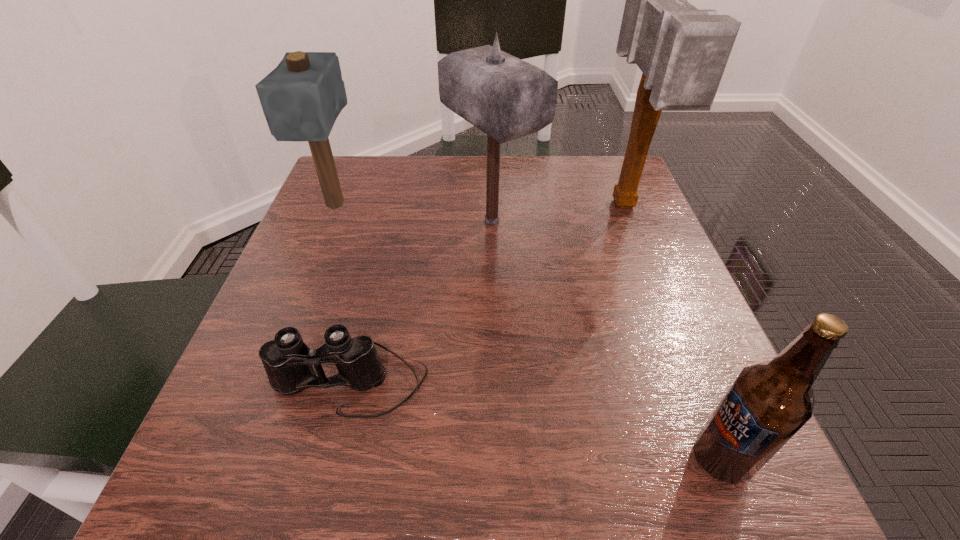
The height and width of the screenshot is (540, 960). Identify the location of the rightmost mallet. [682, 51].

Find the location of a particular element. This screenshot has width=960, height=540. the second mallet from right to left is located at coordinates (505, 97).

Find the location of a particular element. The width and height of the screenshot is (960, 540). the leftmost mallet is located at coordinates (301, 98).

Image resolution: width=960 pixels, height=540 pixels. In order to click on the fourth tallest object in this screenshot , I will do `click(767, 404)`.

Find the location of `beer bottle`. beer bottle is located at coordinates (767, 404).

Locate an element on the screen. binoculars is located at coordinates [x=287, y=360].

Locate an element on the screen. the fourth farthest object is located at coordinates (287, 360).

At what (x,y) coordinates should I click in order to perform the action: click on free location located 0.350m on the left of the rightmost mallet. Please return your answer as a coordinate pair (x, y). The height and width of the screenshot is (540, 960). Looking at the image, I should click on (451, 206).

What are the coordinates of `free space located on the front of the third object from left to right` in the screenshot? It's located at (498, 413).

Where is `free space located on the right of the leftmost mallet`? free space located on the right of the leftmost mallet is located at coordinates (525, 206).